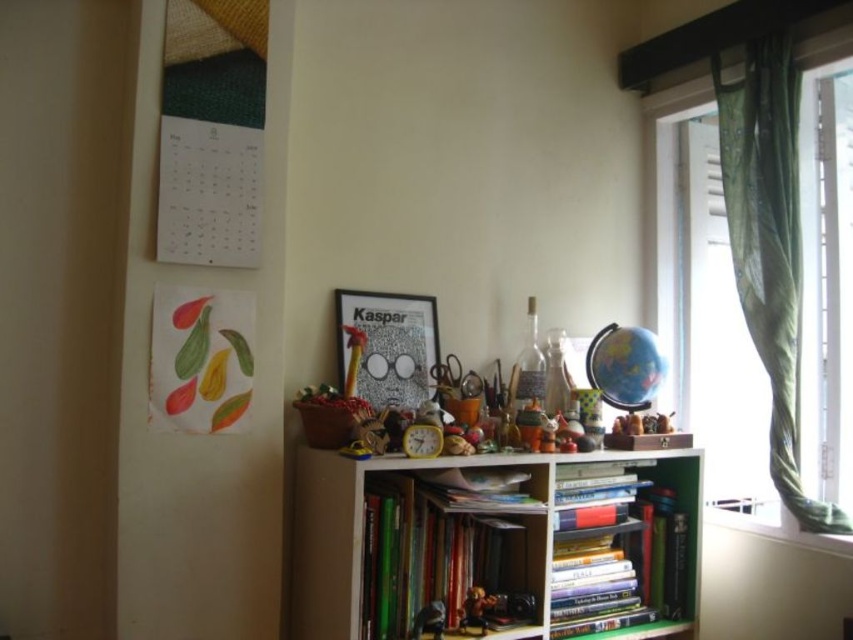
Can you confirm if wooden bookshelf at center is positioned above hardcover book at center?

Yes, wooden bookshelf at center is above hardcover book at center.

Who is positioned more to the right, wooden bookshelf at center or hardcover book at center?

wooden bookshelf at center

Where is `wooden bookshelf at center`? The width and height of the screenshot is (853, 640). wooden bookshelf at center is located at coordinates (494, 545).

Between hardcover books at center and metallic gold figurine at center, which one appears on the right side from the viewer's perspective?

hardcover books at center

Is hardcover books at center above metallic gold figurine at center?

Yes.

Is point (646, 472) farther from camera compared to point (474, 609)?

Yes, it is.

At what (x,y) coordinates should I click in order to perform the action: click on hardcover books at center. Please return your answer as a coordinate pair (x, y). This screenshot has width=853, height=640. Looking at the image, I should click on (627, 552).

Is hardcover books at center above hardcover book at center?

No.

Is point (650, 547) farther from viewer compared to point (366, 529)?

Yes.

You are a GUI agent. You are given a task and a screenshot of the screen. Output one action in this format:
    pyautogui.click(x=<x>, y=<y>)
    Task: Click on the hardcover books at center
    
    Given the screenshot: What is the action you would take?
    pyautogui.click(x=627, y=552)